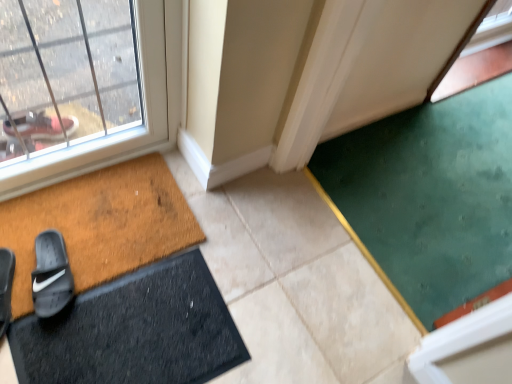
The width and height of the screenshot is (512, 384). I want to click on vacant area to the right of black suede slide at lower left, the 1th footwear viewed from the left, so click(49, 317).